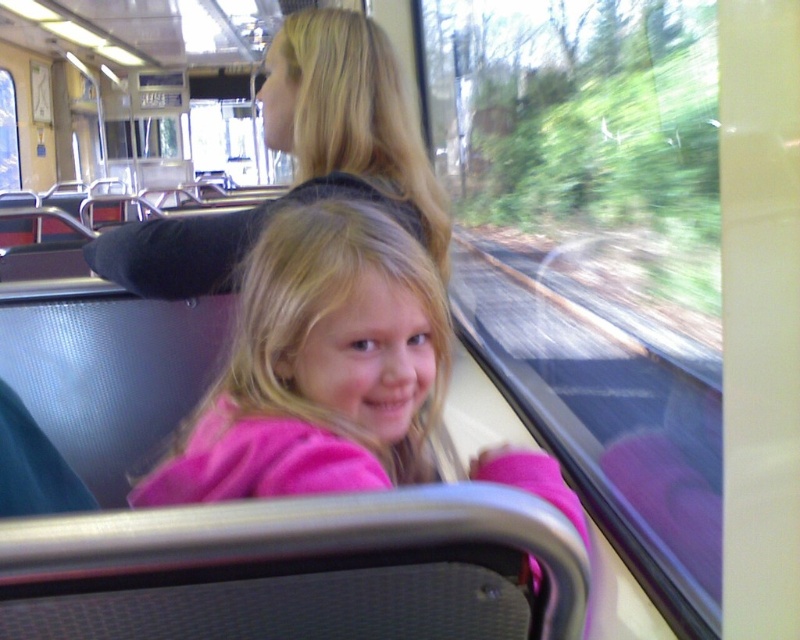
You are a passenger on the train and want to put your backpack between the transparent glass train window at center and the pink fleece jacket at center. The backpack is 1.3 meters long. Will it fit in the space between them?

The distance between the transparent glass train window at center and the pink fleece jacket at center is 1.42 meters. Since the backpack is 1.3 meters long, it will fit in the space between them with 0.12 meters of extra space remaining.

You are standing at point (381, 360) and want to move forward to the front of the train. Which direction should you walk relative to point (560, 225)?

Since point (560, 225) is behind point (381, 360), you should walk in the opposite direction of point (560, 225) to move forward towards the front of the train.